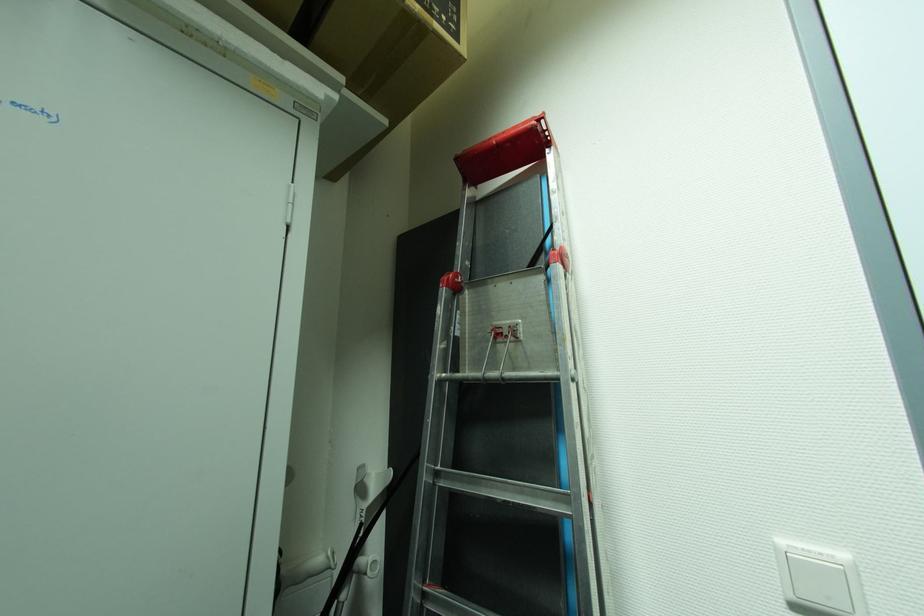
Identify the location of white light switch. (820, 582).